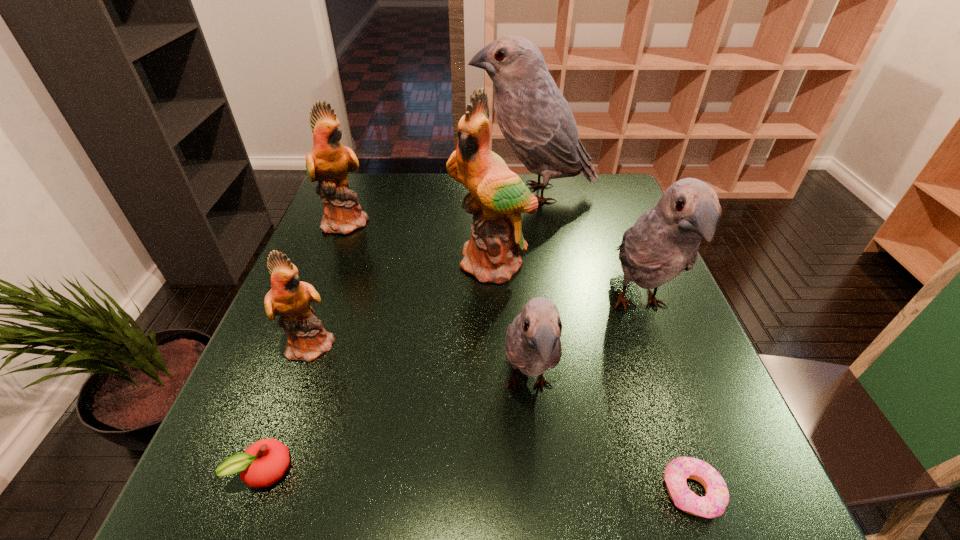
What are the coordinates of `vacant area between the smallest gray parrot and the doughnut` in the screenshot? It's located at (610, 439).

At what (x,y) coordinates should I click in order to perform the action: click on unoccupied area between the second smallest gray parrot and the smallest gray parrot. Please return your answer as a coordinate pair (x, y). The image size is (960, 540). Looking at the image, I should click on (584, 346).

Identify which object is located as the third nearest to the biggest gray parrot. Please provide its 2D coordinates. Your answer should be formatted as a tuple, i.e. [(x, y)], where the tuple contains the x and y coordinates of a point satisfying the conditions above.

[(328, 162)]

I want to click on the seventh closest object to the red apple, so click(x=536, y=120).

Locate an element on the screen. parrot identified as the fifth closest to the second biggest gray parrot is located at coordinates (328, 162).

Locate an element on the screen. The image size is (960, 540). parrot that is the fourth closest one to the pink doughnut is located at coordinates (307, 339).

At what (x,y) coordinates should I click in order to perform the action: click on the closest gray parrot to the red apple. Please return your answer as a coordinate pair (x, y). Looking at the image, I should click on (532, 344).

I want to click on the closest gray parrot to the smallest gray parrot, so click(x=664, y=241).

Select which green parrot appears as the closest to the nearest green parrot. Please provide its 2D coordinates. Your answer should be formatted as a tuple, i.e. [(x, y)], where the tuple contains the x and y coordinates of a point satisfying the conditions above.

[(497, 196)]

Locate which green parrot is the third closest to the biggest gray parrot. Please provide its 2D coordinates. Your answer should be formatted as a tuple, i.e. [(x, y)], where the tuple contains the x and y coordinates of a point satisfying the conditions above.

[(307, 339)]